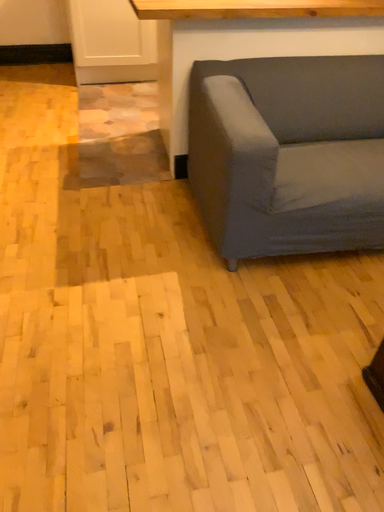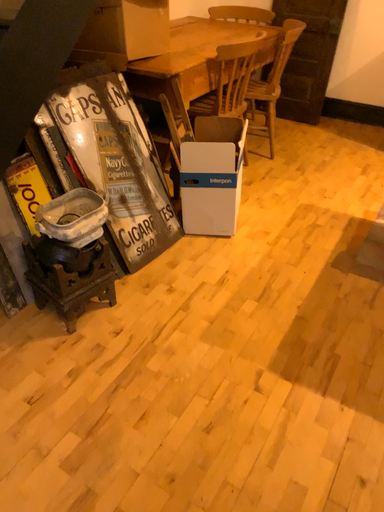
Question: How did the camera likely rotate when shooting the video?

Choices:
 (A) rotated downward
 (B) rotated upward

Answer: (B)